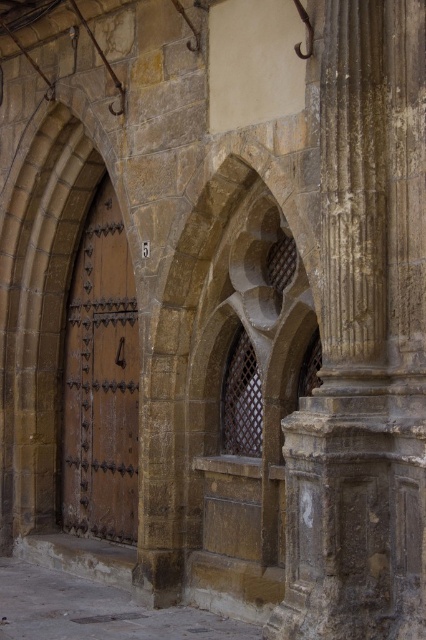
You are a painter hired to restore the old stone building. You need to decide which object requires more material for covering its surface area. Based on the description, which object would need more material between the brown stone column at right and the matte brown door at center?

The matte brown door at center requires more material because the brown stone column at right is thinner, meaning it has a smaller surface area compared to the matte brown door at center.

You are an architect inspecting the old stone building. You notice the brown stone archway at center and the matte brown door at center. Which structure has a greater height?

The matte brown door at center has a greater height than the brown stone archway at center.

You are an architect inspecting the old stone building. You need to determine which object takes up more visual space in the image between the brown stone column at right and the matte brown door at center. Which one occupies more area?

The matte brown door at center occupies more area than the brown stone column at right because the column takes up less space according to the description.